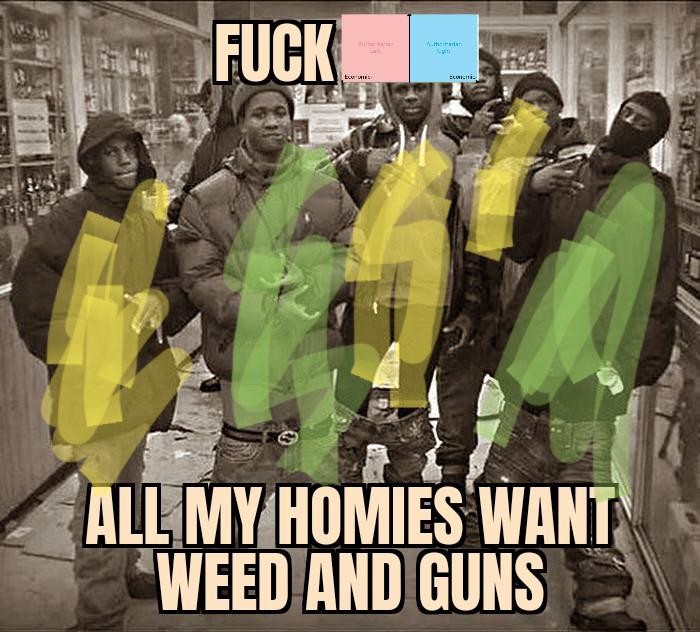
Image resolution: width=700 pixels, height=632 pixels. Identify the location of shelves. (17, 82), (122, 85), (680, 59), (626, 76), (522, 59), (344, 94).